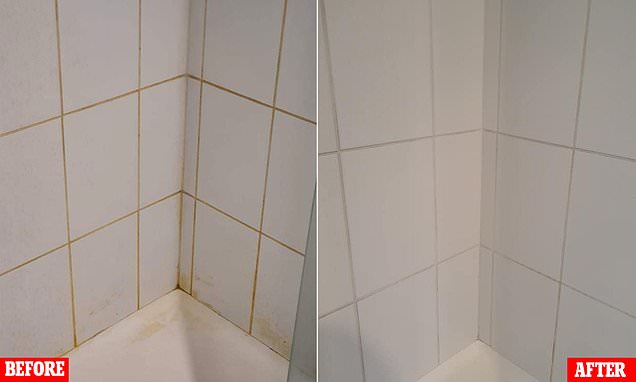
You are a GUI agent. You are given a task and a screenshot of the screen. Output one action in this format:
    pyautogui.click(x=<x>, y=<y>)
    Task: Click on the stain on edge of shower cubicle
    This screenshot has height=382, width=636.
    Given the screenshot: What is the action you would take?
    pyautogui.click(x=148, y=332)